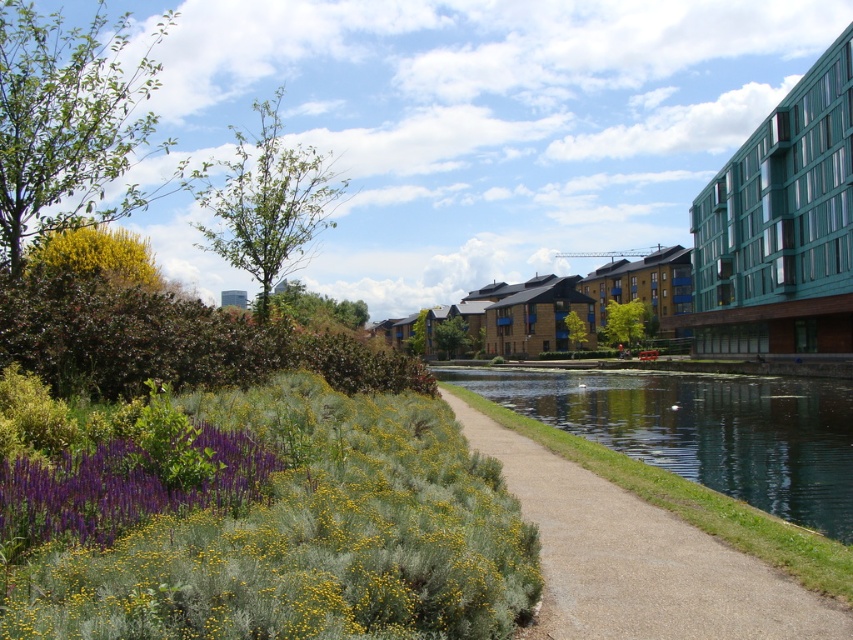
Question: Does green fuzzy bush at lower left appear over smooth concrete path at center?

Choices:
 (A) no
 (B) yes

Answer: (B)

Question: Which object is farther from the camera taking this photo?

Choices:
 (A) green fuzzy bush at lower left
 (B) smooth concrete path at center

Answer: (A)

Question: Does green fuzzy bush at lower left have a smaller size compared to smooth concrete path at center?

Choices:
 (A) yes
 (B) no

Answer: (A)

Question: Is green fuzzy bush at lower left above smooth concrete path at center?

Choices:
 (A) no
 (B) yes

Answer: (B)